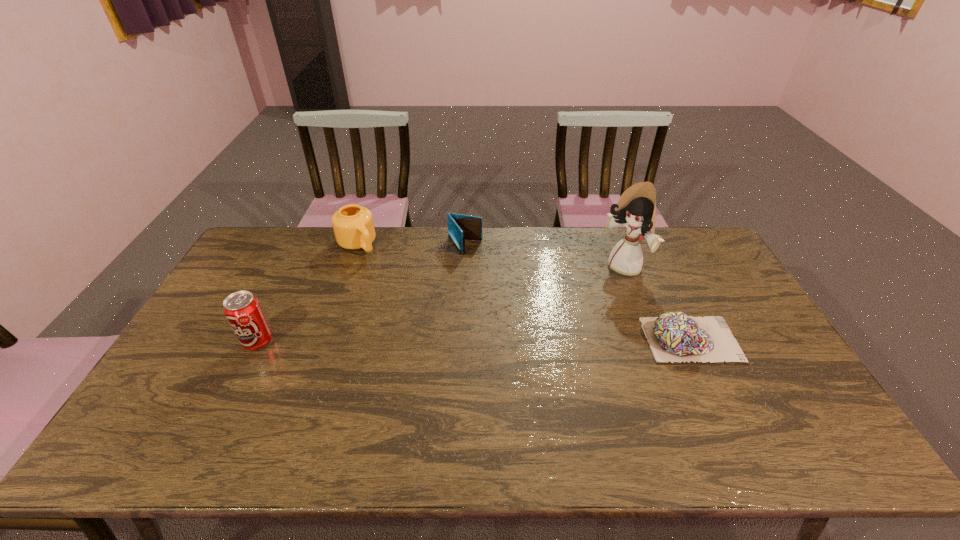
You are a GUI agent. You are given a task and a screenshot of the screen. Output one action in this format:
    pyautogui.click(x=<x>, y=<y>)
    Task: Click on the fourth shortest object
    
    Given the screenshot: What is the action you would take?
    (x=243, y=311)

This screenshot has height=540, width=960. Identify the location of soda. (243, 311).

Where is `the shortest object`? This screenshot has width=960, height=540. the shortest object is located at coordinates (673, 336).

The height and width of the screenshot is (540, 960). In order to click on the third object from right to left in this screenshot , I will do `click(461, 227)`.

I want to click on the fourth tallest object, so click(x=461, y=227).

Locate an element on the screen. The height and width of the screenshot is (540, 960). doll is located at coordinates (636, 209).

Find the location of a particular element. the third tallest object is located at coordinates (353, 225).

The image size is (960, 540). In order to click on mug in this screenshot , I will do `click(353, 225)`.

Image resolution: width=960 pixels, height=540 pixels. I want to click on free spot located 0.160m on the right of the soda, so click(329, 342).

Where is `vacant space located 0.070m on the front, side, and top of the cap`? vacant space located 0.070m on the front, side, and top of the cap is located at coordinates (759, 339).